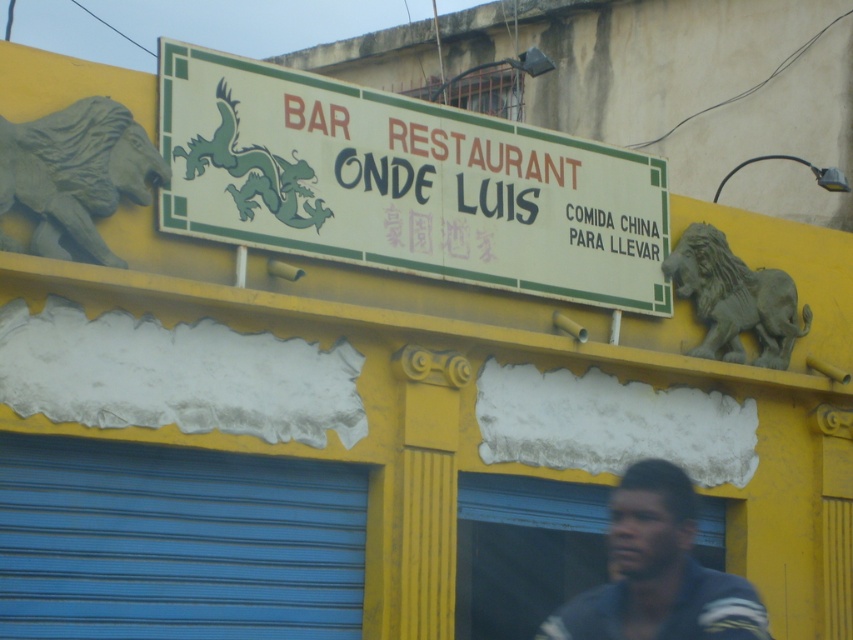
Does blue metallic garage door at lower left have a greater height compared to gray stone lion at upper left?

Indeed, blue metallic garage door at lower left has a greater height compared to gray stone lion at upper left.

Between point (129, 636) and point (30, 172), which one is positioned behind?

Positioned behind is point (129, 636).

Does point (294, 586) lie behind point (112, 141)?

Yes, point (294, 586) is farther from viewer.

Find the location of a particular element. This screenshot has width=853, height=640. blue metallic garage door at lower left is located at coordinates (177, 541).

Does blue metallic garage door at lower left have a larger size compared to dark blue shirt at lower center?

Indeed, blue metallic garage door at lower left has a larger size compared to dark blue shirt at lower center.

In the scene shown: Does blue metallic garage door at lower left come in front of dark blue shirt at lower center?

No, blue metallic garage door at lower left is behind dark blue shirt at lower center.

This screenshot has width=853, height=640. In order to click on blue metallic garage door at lower left in this screenshot , I will do `click(177, 541)`.

Who is taller, dark blue shirt at lower center or gray stone lion at upper left?

gray stone lion at upper left

Can you confirm if dark blue shirt at lower center is shorter than gray stone lion at upper left?

Correct, dark blue shirt at lower center is not as tall as gray stone lion at upper left.

Which is behind, point (647, 548) or point (83, 228)?

The point (83, 228) is more distant.

Identify the location of dark blue shirt at lower center. (659, 572).